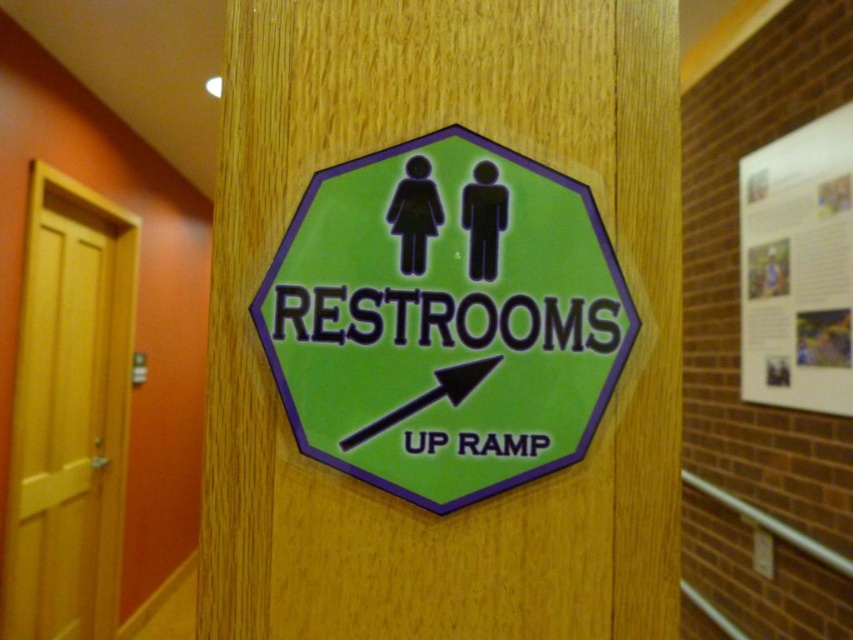
You are standing in a hallway and see the green plastic sign at center and the white paper poster at upper right. Which object is located to the left of the other?

The green plastic sign at center is positioned on the left side of white paper poster at upper right.